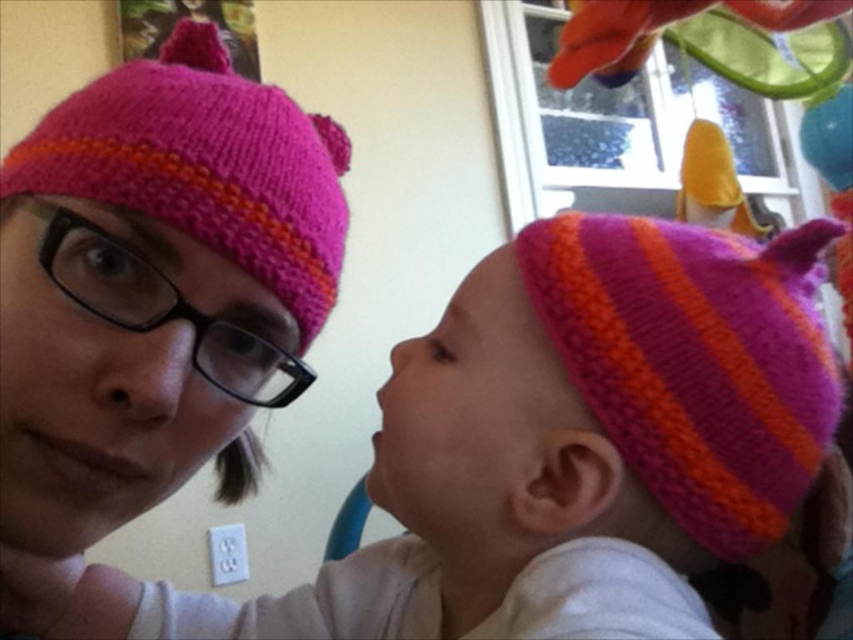
From the picture: Can you confirm if pink knitted hat at upper right is shorter than matte knitted hat at center?

No.

Does pink knitted hat at upper right appear over matte knitted hat at center?

Actually, pink knitted hat at upper right is below matte knitted hat at center.

At what (x,y) coordinates should I click in order to perform the action: click on pink knitted hat at upper right. Please return your answer as a coordinate pair (x, y). Looking at the image, I should click on pos(548,451).

Locate an element on the screen. This screenshot has width=853, height=640. pink knitted hat at upper right is located at coordinates (548, 451).

Is pink knitted hat at upper right taller than matte pink knit hat at upper left?

No.

Consider the image. Can you confirm if pink knitted hat at upper right is positioned above matte pink knit hat at upper left?

No.

Is point (175, 634) closer to viewer compared to point (143, 342)?

That is False.

This screenshot has height=640, width=853. I want to click on pink knitted hat at upper right, so click(548, 451).

Is point (96, 460) farther from camera compared to point (817, 272)?

No, it is in front of (817, 272).

How far apart are matte pink knit hat at upper left and matte knitted hat at center?

The distance of matte pink knit hat at upper left from matte knitted hat at center is 7.89 inches.

Which is behind, point (123, 292) or point (775, 497)?

The point (775, 497) is more distant.

In order to click on matte pink knit hat at upper left in this screenshot , I will do `click(155, 285)`.